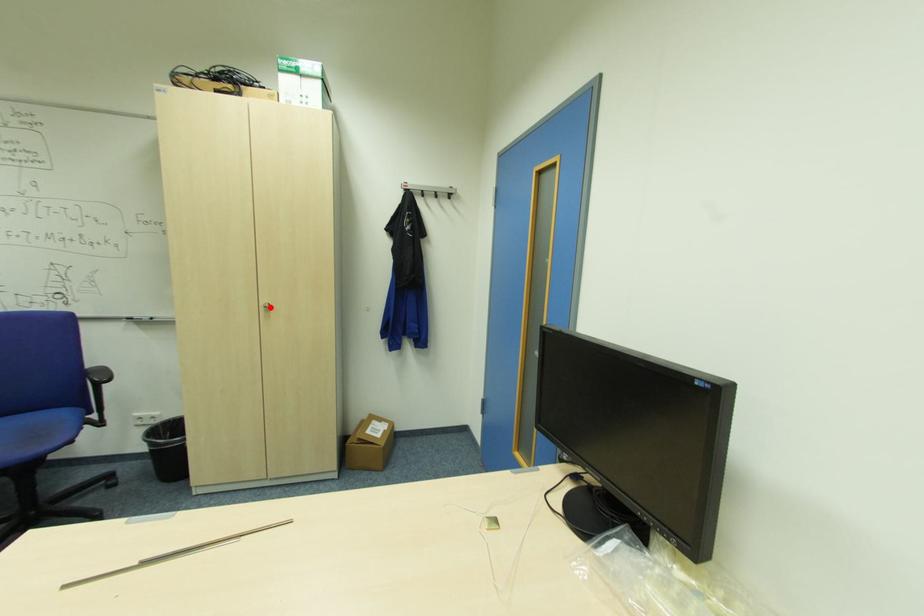
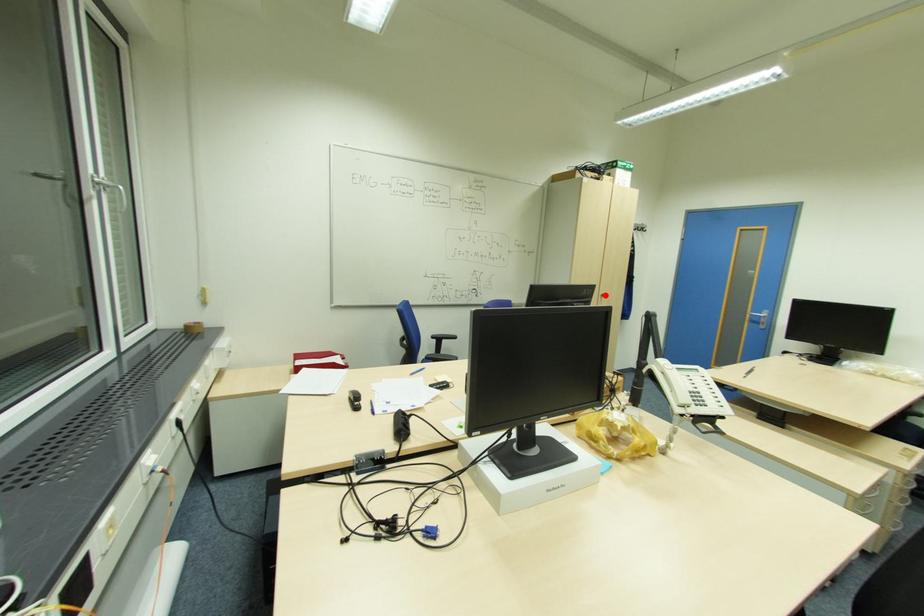
I am providing you with two images of the same scene from different viewpoints. A red point is marked on the first image and another point is marked on the second image. Does the point marked in image1 correspond to the same location as the one in image2?

Yes